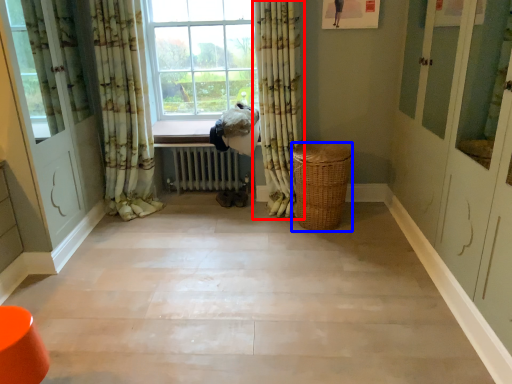
Question: Which point is further to the camera, curtain (highlighted by a red box) or basket (highlighted by a blue box)?

Choices:
 (A) curtain
 (B) basket

Answer: (B)